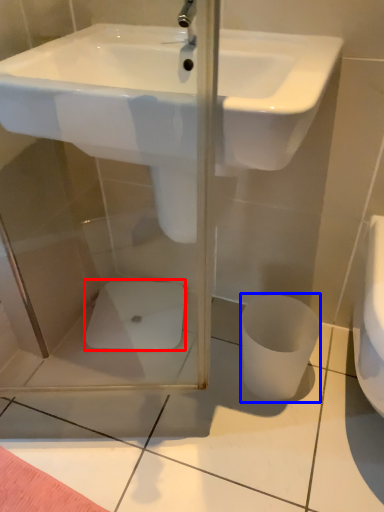
Question: Which of the following is the farthest to the observer, porcelain (highlighted by a red box) or toilet bowl (highlighted by a blue box)?

Choices:
 (A) porcelain
 (B) toilet bowl

Answer: (A)